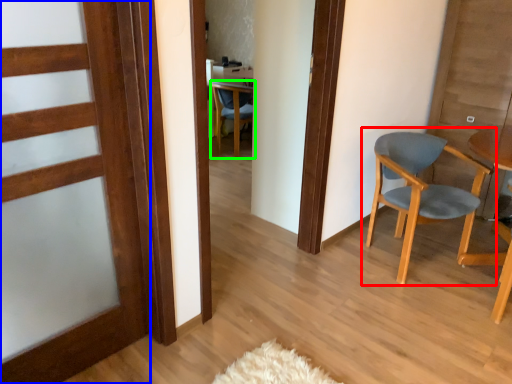
Question: Which object is positioned farthest from chair (highlighted by a red box)? Select from door (highlighted by a blue box) and chair (highlighted by a green box).

Choices:
 (A) door
 (B) chair

Answer: (B)